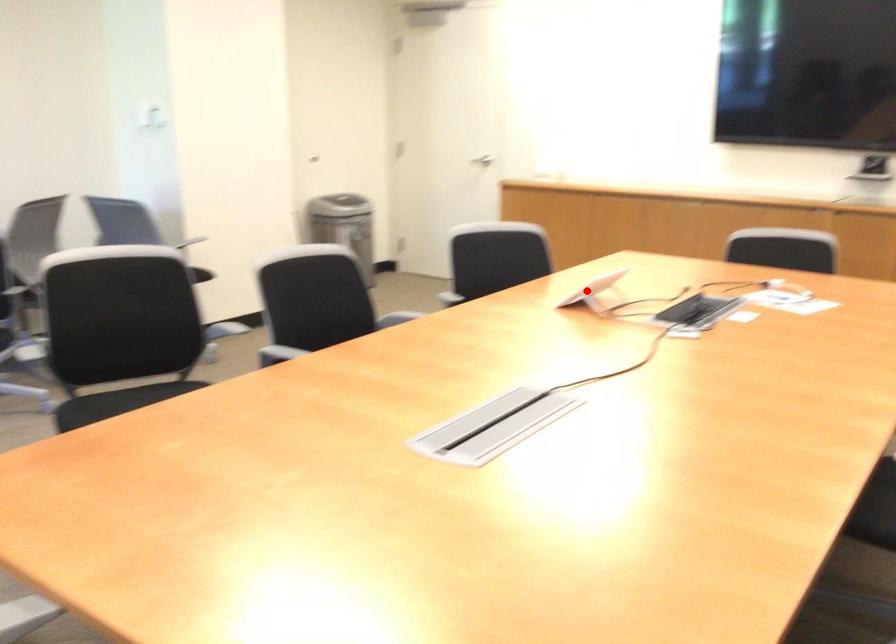
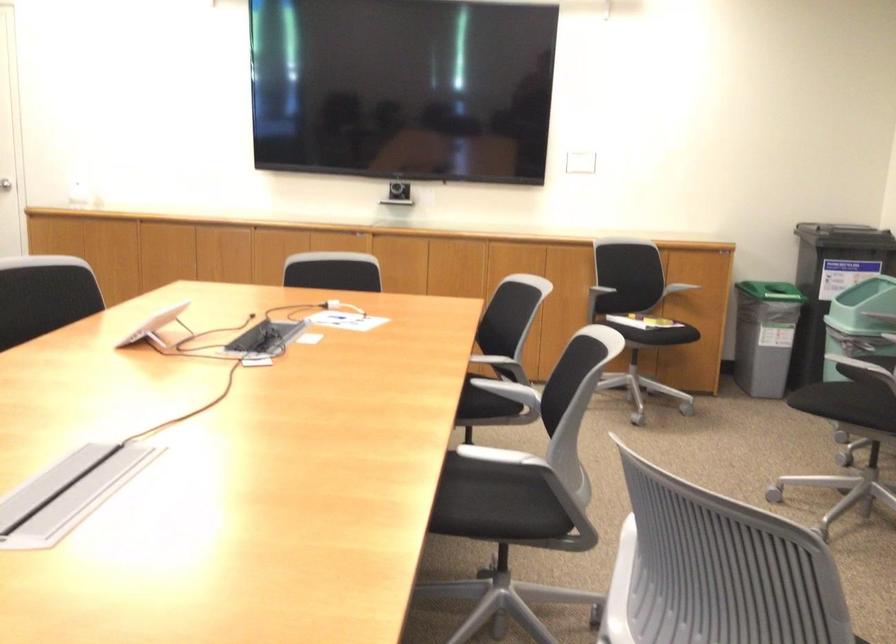
Find the pixel in the second image that matches the highlighted location in the first image.

(156, 327)